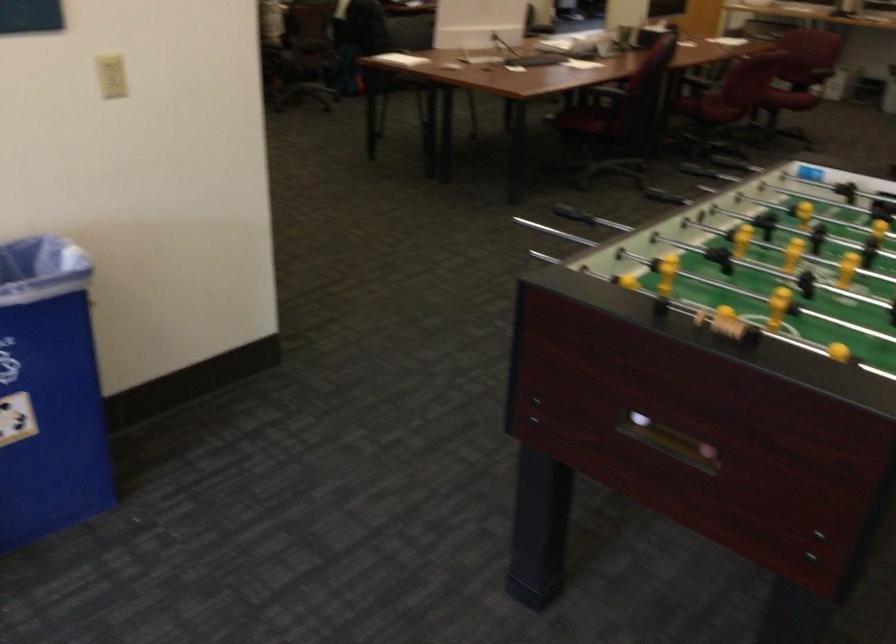
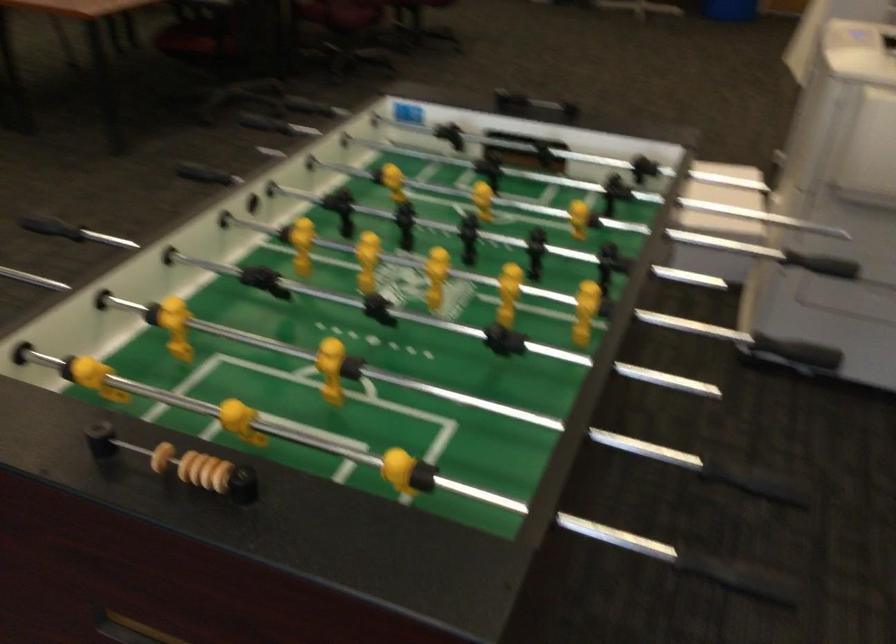
Locate, in the second image, the point that corresponds to the point at 730,323 in the first image.

(204, 471)